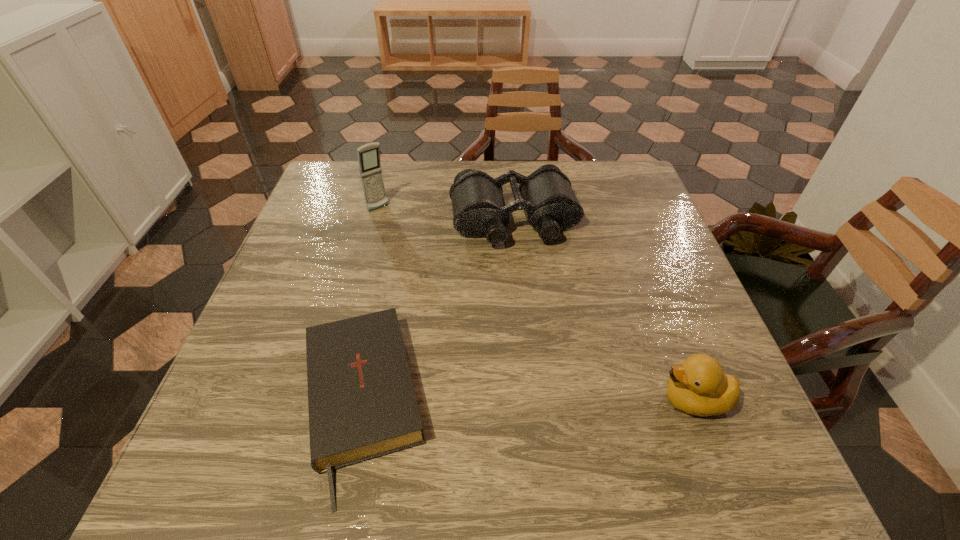
Find the location of a particular element. free space located on the front-facing side of the cellular telephone is located at coordinates (451, 292).

Where is `vacant area situated 0.240m through the eyepieces of the binoculars`? vacant area situated 0.240m through the eyepieces of the binoculars is located at coordinates (546, 330).

Find the location of a particular element. The image size is (960, 540). free space located 0.360m through the eyepieces of the binoculars is located at coordinates 561,381.

Where is `vacant region located through the eyepieces of the binoculars`? The image size is (960, 540). vacant region located through the eyepieces of the binoculars is located at coordinates click(x=535, y=288).

Find the location of `cellular telephone that is positioned at the far edge`. cellular telephone that is positioned at the far edge is located at coordinates (370, 168).

The height and width of the screenshot is (540, 960). I want to click on binoculars that is at the far edge, so tap(479, 210).

You are a GUI agent. You are given a task and a screenshot of the screen. Output one action in this format:
    pyautogui.click(x=<x>, y=<y>)
    Task: Click on the Bible at the near edge
    Image resolution: width=960 pixels, height=540 pixels.
    Given the screenshot: What is the action you would take?
    pyautogui.click(x=362, y=405)

Find the location of a particular element. duckling located at the near edge is located at coordinates (698, 386).

Where is `object situated at the left edge`? object situated at the left edge is located at coordinates (362, 405).

What are the coordinates of `object that is positioned at the right edge` in the screenshot? It's located at 698,386.